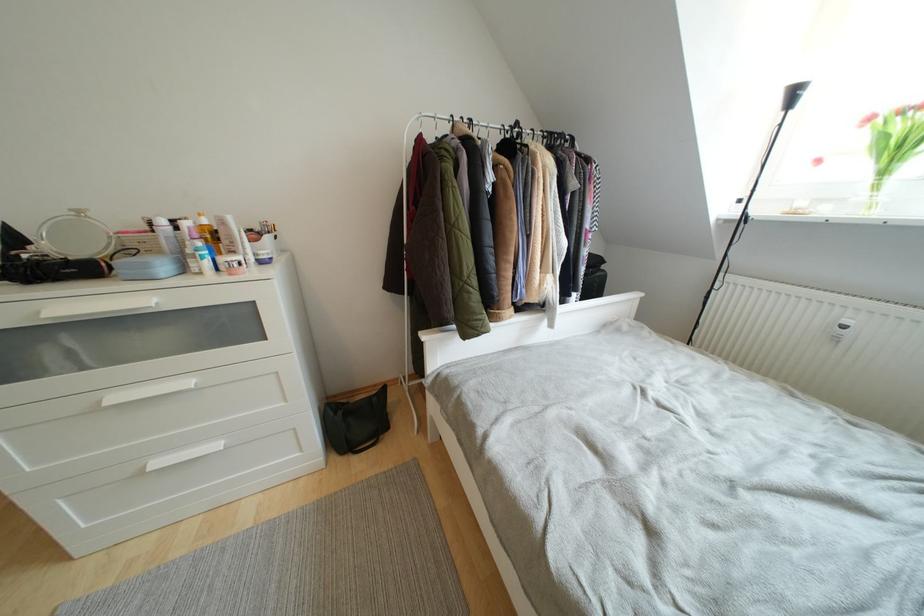
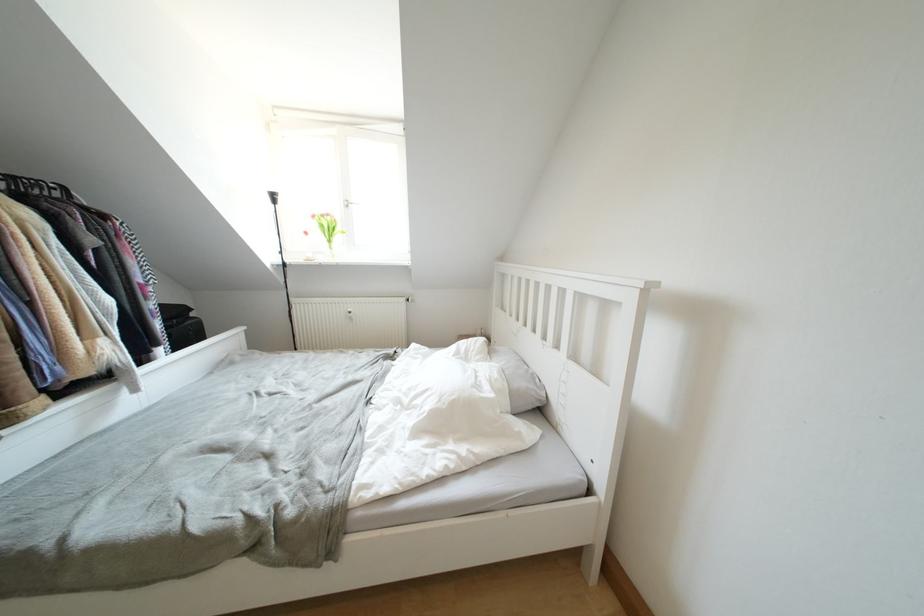
Locate, in the second image, the point that corresponds to the point at 877,122 in the first image.

(319, 220)